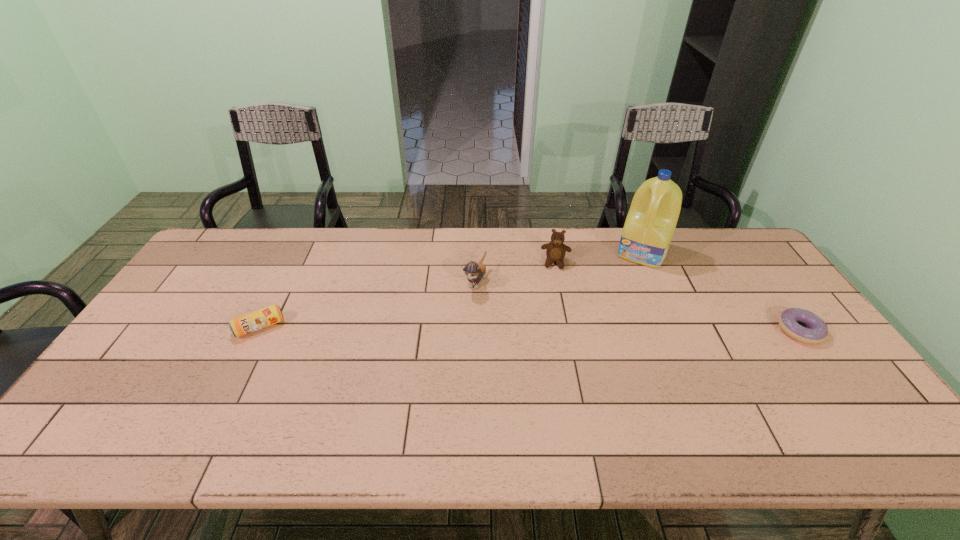
Image resolution: width=960 pixels, height=540 pixels. What are the coordinates of `the leftmost object` in the screenshot? It's located at (242, 325).

Where is `the second shortest object`? This screenshot has width=960, height=540. the second shortest object is located at coordinates (242, 325).

The image size is (960, 540). What are the coordinates of `the shortest object` in the screenshot? It's located at (817, 331).

The image size is (960, 540). What are the coordinates of `the rightmost object` in the screenshot? It's located at (817, 331).

You are a GUI agent. You are given a task and a screenshot of the screen. Output one action in this format:
    pyautogui.click(x=<x>, y=<y>)
    Task: Click on the detergent
    
    Given the screenshot: What is the action you would take?
    pyautogui.click(x=651, y=221)

Where is `the second object from right to left`? The width and height of the screenshot is (960, 540). the second object from right to left is located at coordinates (651, 221).

Where is `the second object from left to right`? The height and width of the screenshot is (540, 960). the second object from left to right is located at coordinates (474, 272).

You are a GUI agent. You are given a task and a screenshot of the screen. Output one action in this format:
    pyautogui.click(x=<x>, y=<y>)
    Task: Click on the third object from left to right
    The height and width of the screenshot is (540, 960).
    Given the screenshot: What is the action you would take?
    pyautogui.click(x=555, y=250)

The height and width of the screenshot is (540, 960). I want to click on vacant space positioned 0.190m on the front of the fourth tallest object, so click(222, 401).

This screenshot has width=960, height=540. I want to click on vacant area situated on the back of the rightmost object, so click(746, 257).